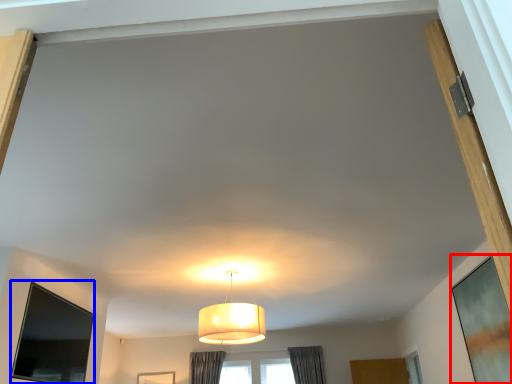
Question: Which point is closer to the camera, window screen (highlighted by a red box) or window screen (highlighted by a blue box)?

Choices:
 (A) window screen
 (B) window screen

Answer: (A)